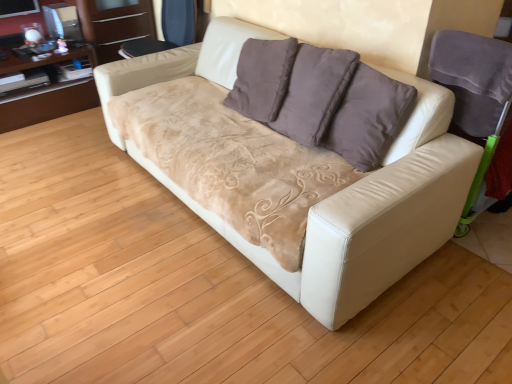
The image size is (512, 384). I want to click on free space to the left of white leather couch at center, so click(75, 201).